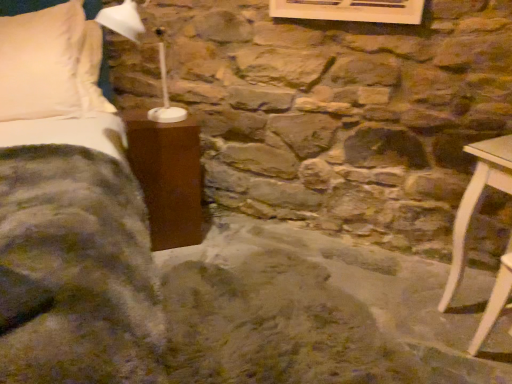
This screenshot has height=384, width=512. Identify the location of vacant space to the right of matte brown nightstand at left, which appears as the 1th furniture when viewed from the back. (223, 235).